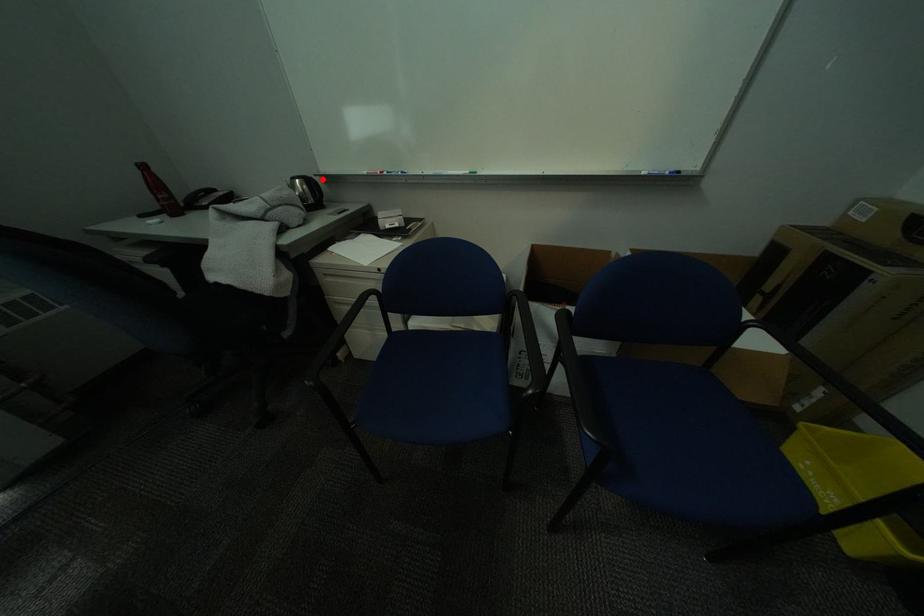
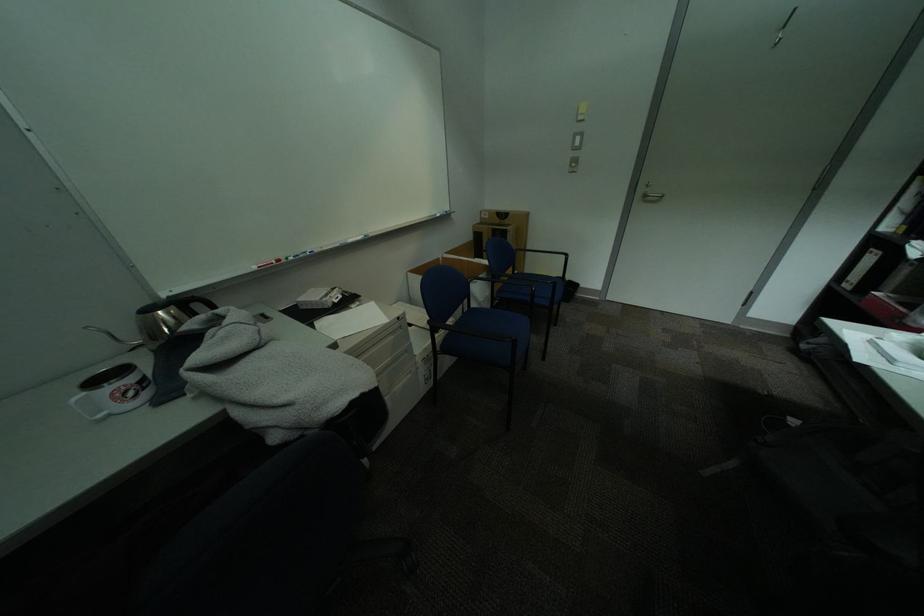
Find the pixel in the second image that matches the highlighted location in the first image.

(204, 297)